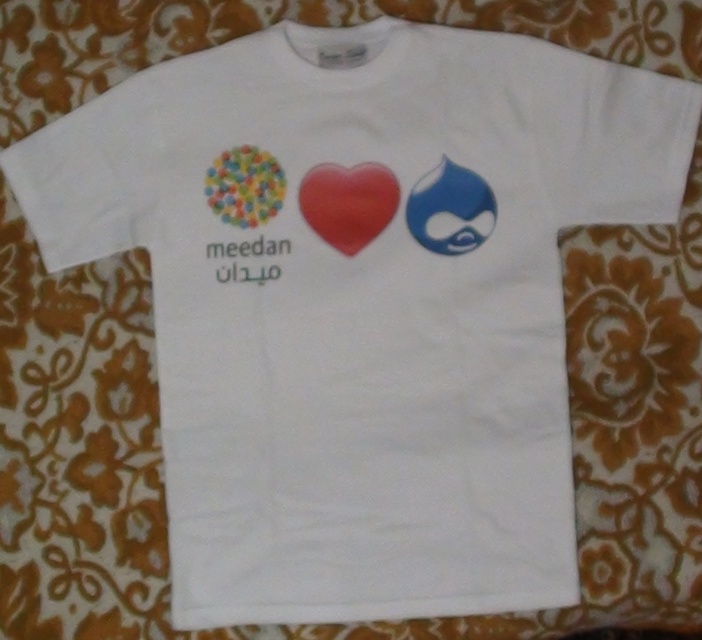
Question: Among these objects, which one is farthest from the camera?

Choices:
 (A) blue glossy whale at upper right
 (B) multicolored glossy beads at upper left
 (C) matte red heart at center

Answer: (C)

Question: Does blue glossy whale at upper right appear under multicolored glossy beads at upper left?

Choices:
 (A) yes
 (B) no

Answer: (A)

Question: Does matte red heart at center have a greater width compared to multicolored glossy beads at upper left?

Choices:
 (A) yes
 (B) no

Answer: (A)

Question: Which point is farther to the camera?

Choices:
 (A) [x=211, y=202]
 (B) [x=490, y=218]
 (C) [x=366, y=163]

Answer: (C)

Question: Observing the image, what is the correct spatial positioning of blue glossy whale at upper right in reference to multicolored glossy beads at upper left?

Choices:
 (A) right
 (B) left

Answer: (A)

Question: Which point appears closest to the camera in this image?

Choices:
 (A) (423, 225)
 (B) (218, 173)

Answer: (A)